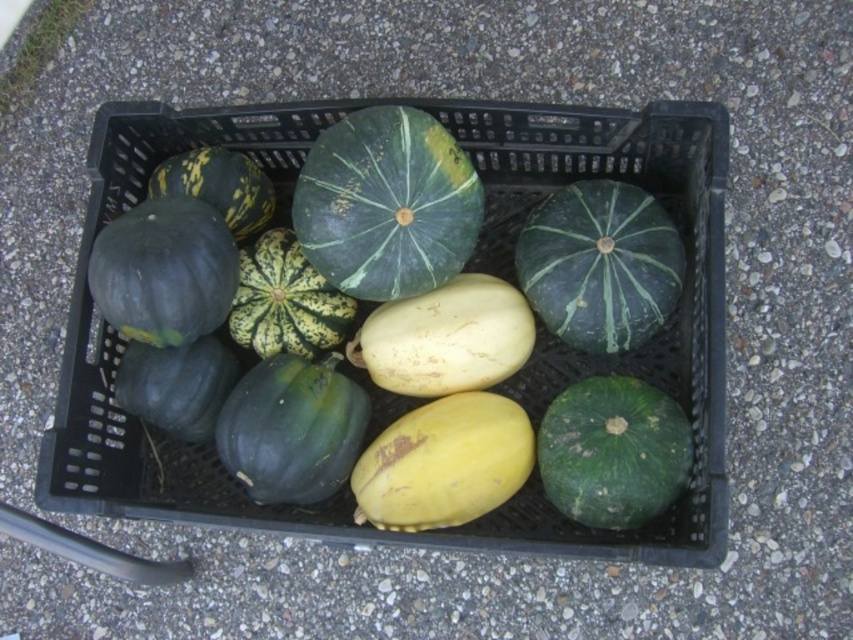
Question: Is black plastic basket at center further to the viewer compared to green matte squash at center?

Choices:
 (A) yes
 (B) no

Answer: (B)

Question: Among these objects, which one is nearest to the camera?

Choices:
 (A) black plastic basket at center
 (B) green matte squash at center

Answer: (A)

Question: Is black plastic basket at center in front of green matte squash at center?

Choices:
 (A) yes
 (B) no

Answer: (A)

Question: Is the position of black plastic basket at center less distant than that of green matte squash at center?

Choices:
 (A) yes
 (B) no

Answer: (A)